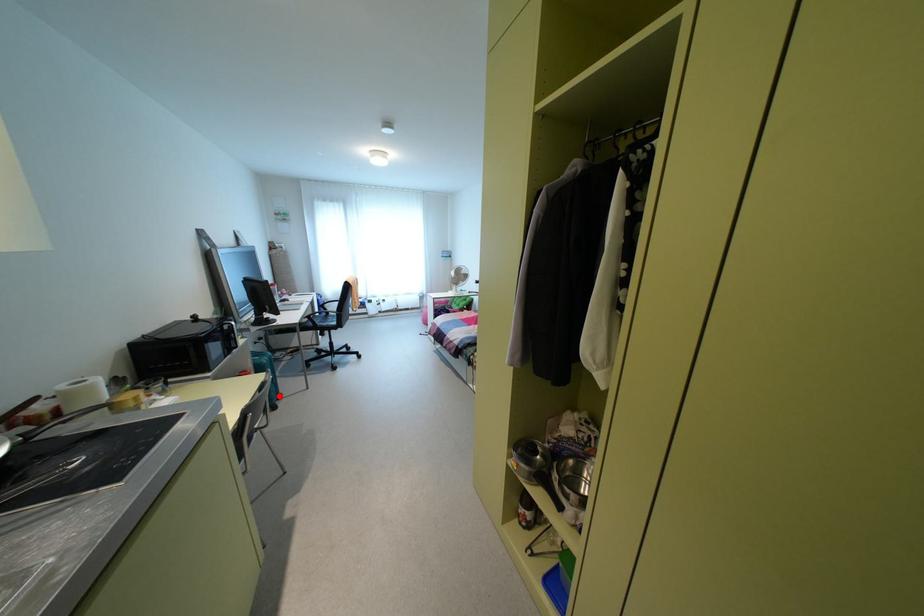
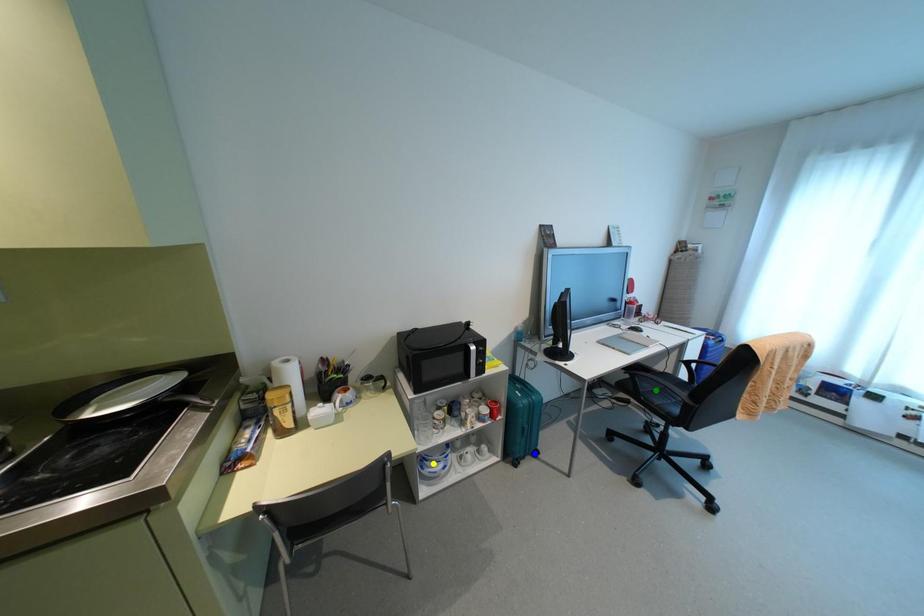
Question: I am providing you with two images of the same scene from different viewpoints. A red point is marked on the first image. You are given multiple points on the second image. Which point in image 2 is actually the same real-world point as the red point in image 1?

Choices:
 (A) yellow point
 (B) green point
 (C) blue point

Answer: (C)